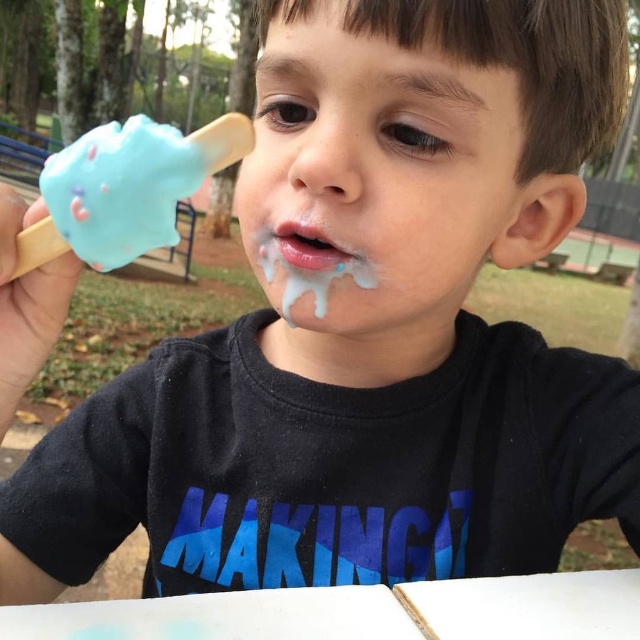
Is point (173, 220) farther from camera compared to point (282, 296)?

No, it is in front of (282, 296).

Can you confirm if blue matte ice cream cone at left is smaller than blue creamy frosting at mouth?

Incorrect, blue matte ice cream cone at left is not smaller in size than blue creamy frosting at mouth.

This screenshot has width=640, height=640. I want to click on blue matte ice cream cone at left, so click(125, 189).

Where is `blue matte ice cream cone at left`? The image size is (640, 640). blue matte ice cream cone at left is located at coordinates (125, 189).

Is blue matte ice cream cone at left positioned at the back of white matte lips at center?

No, blue matte ice cream cone at left is in front of white matte lips at center.

Which of these two, blue matte ice cream cone at left or white matte lips at center, stands taller?

With more height is blue matte ice cream cone at left.

You are a GUI agent. You are given a task and a screenshot of the screen. Output one action in this format:
    pyautogui.click(x=<x>, y=<y>)
    Task: Click on the blue matte ice cream cone at left
    The image size is (640, 640).
    Given the screenshot: What is the action you would take?
    pyautogui.click(x=125, y=189)

Is matte blue ice cream at center behind blue creamy frosting at mouth?

No, matte blue ice cream at center is in front of blue creamy frosting at mouth.

Does matte blue ice cream at center have a lesser width compared to blue creamy frosting at mouth?

No.

What do you see at coordinates (380, 170) in the screenshot? I see `matte blue ice cream at center` at bounding box center [380, 170].

Find the location of a particular element. The height and width of the screenshot is (640, 640). matte blue ice cream at center is located at coordinates (380, 170).